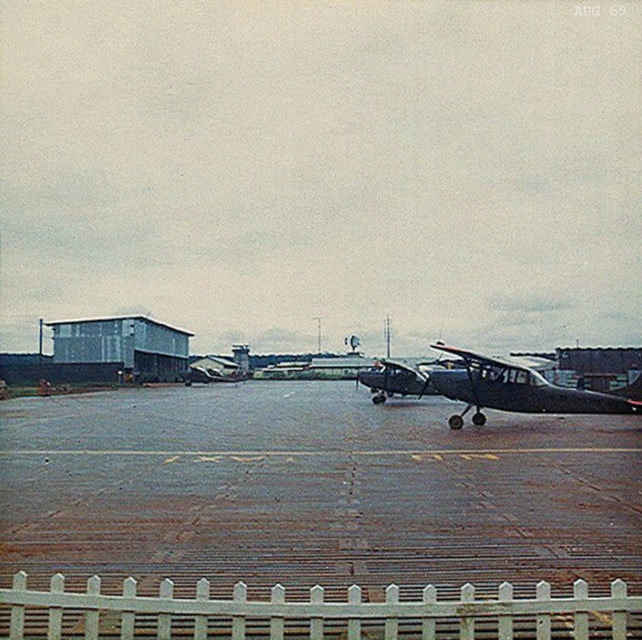
You are standing at the white picket fence in the airport scene from August 1969. You see two points marked in the image. Which point is closer to you, point [440,380] or point [117,317]?

Point [440,380] is closer to the viewer than point [117,317].

You are a pilot standing at the edge of the dark gray asphalt runway at center. You need to reach the metallic gray airplane at center to board it. Can you walk directly to the airplane without leaving the runway?

The dark gray asphalt runway at center is 6.41 meters away from the metallic gray airplane at center, so yes, you can walk directly to the metallic gray airplane at center from the dark gray asphalt runway at center since the distance is manageable on foot.